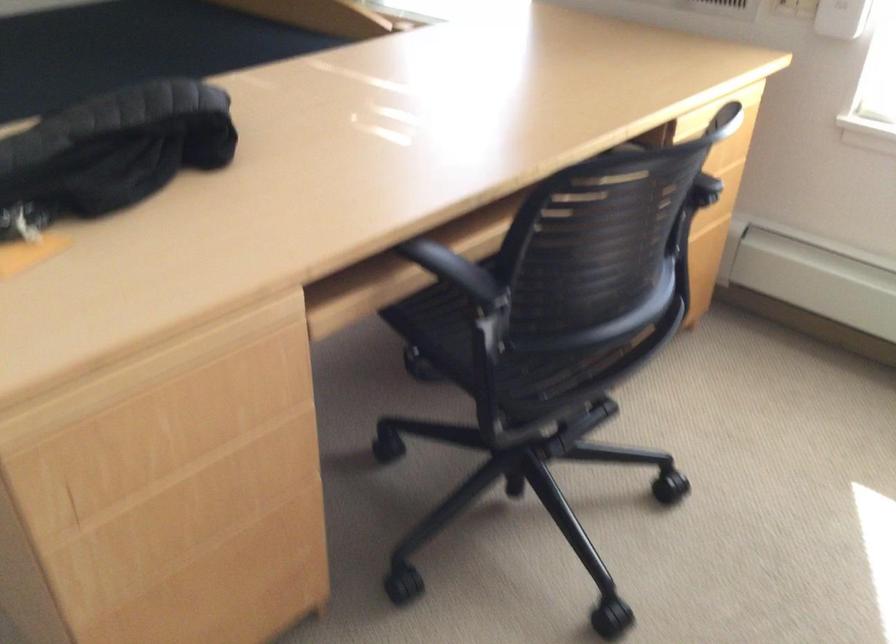
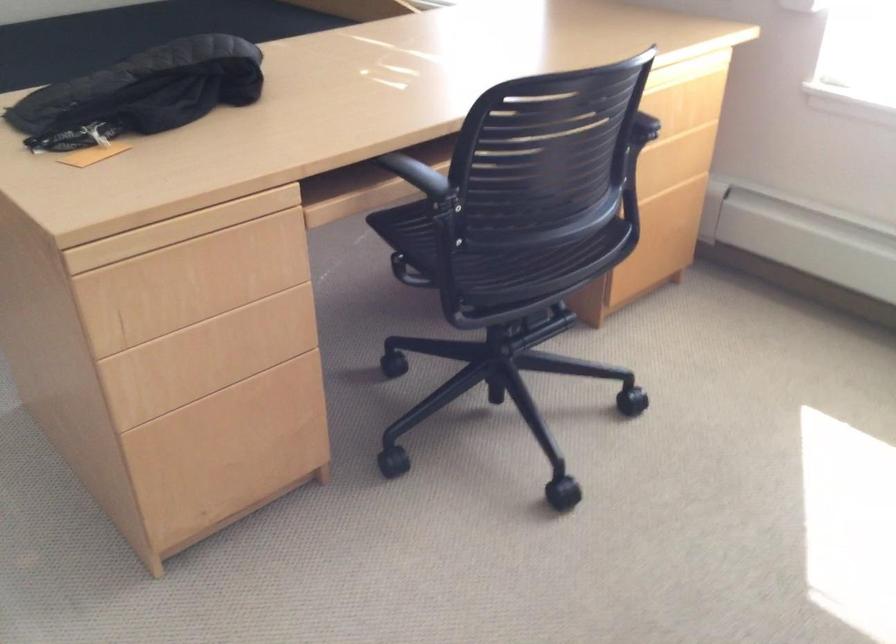
Where in the second image is the point corresponding to the point at 185,518 from the first image?

(201, 361)